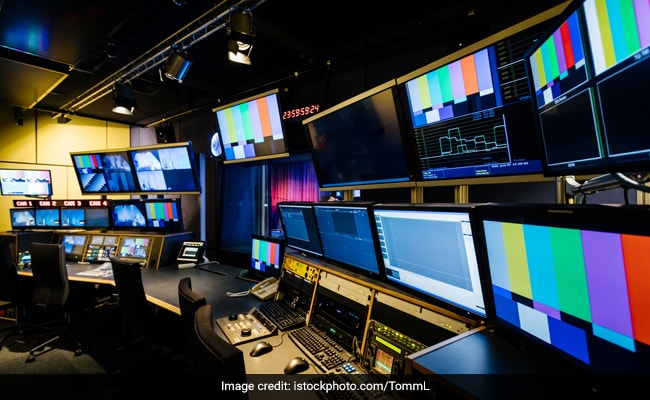
Identify the location of chair. (213, 359), (185, 305), (127, 281), (52, 266), (6, 260).